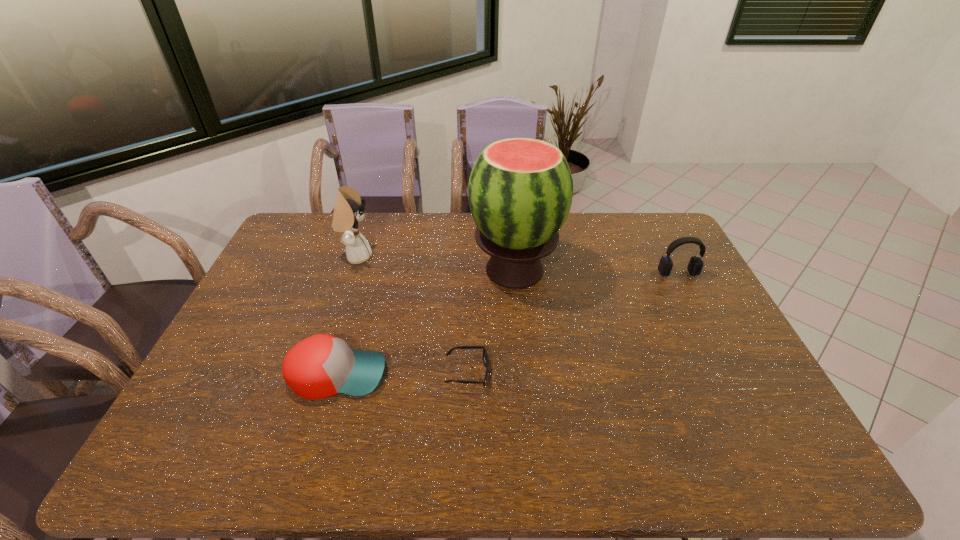
Where is `free space between the doll and the baseball cap`? This screenshot has height=540, width=960. free space between the doll and the baseball cap is located at coordinates (348, 315).

Find the location of `free spot between the baseball cap and the headset`. free spot between the baseball cap and the headset is located at coordinates (508, 324).

Locate an element on the screen. Image resolution: width=960 pixels, height=540 pixels. vacant area that lies between the baseball cap and the third shortest object is located at coordinates (508, 324).

This screenshot has width=960, height=540. In order to click on vacant area that lies between the baseball cap and the tallest object in this screenshot , I will do `click(426, 322)`.

The height and width of the screenshot is (540, 960). I want to click on free area in between the third shortest object and the watermelon, so click(x=596, y=272).

This screenshot has width=960, height=540. In order to click on empty space that is in between the baseball cap and the second tallest object in this screenshot , I will do `click(348, 315)`.

This screenshot has width=960, height=540. In order to click on empty space between the second tallest object and the watermelon in this screenshot , I will do `click(436, 264)`.

In order to click on vacant space that is in between the third tallest object and the baseball cap in this screenshot , I will do `click(508, 324)`.

Locate an element on the screen. The width and height of the screenshot is (960, 540). vacant space that's between the third tallest object and the baseball cap is located at coordinates (508, 324).

You are a GUI agent. You are given a task and a screenshot of the screen. Output one action in this format:
    pyautogui.click(x=<x>, y=<y>)
    Task: Click on the fourth closest object relative to the doll
    
    Given the screenshot: What is the action you would take?
    pyautogui.click(x=695, y=265)